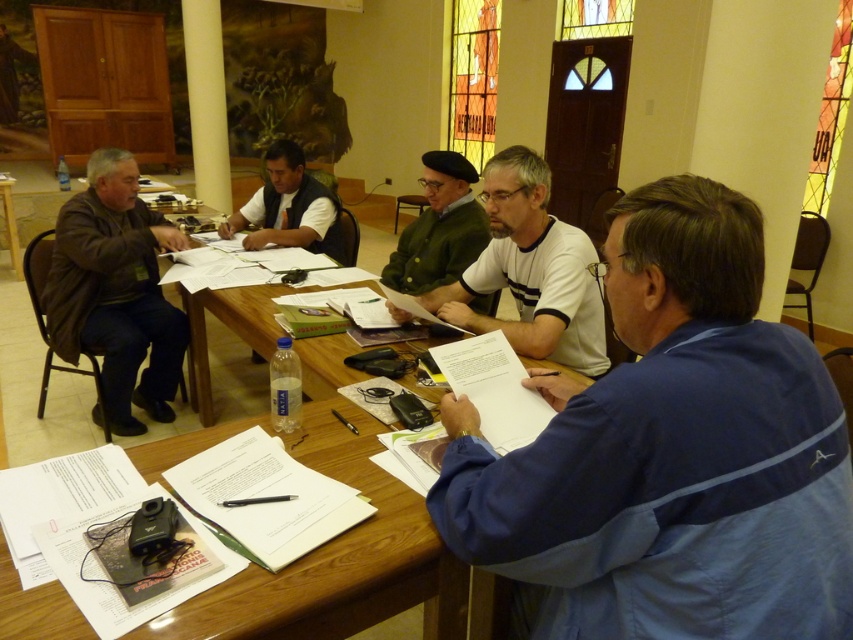
Looking at this image, is white cotton shirt at center wider than wooden table at center?

Yes.

In the scene shown: Is white cotton shirt at center above wooden table at center?

Actually, white cotton shirt at center is below wooden table at center.

Between point (519, 156) and point (12, 211), which one is positioned in front?

Point (519, 156) is in front.

Identify the location of white cotton shirt at center. point(531,269).

Who is lower down, blue fabric shirt at center or white cotton shirt at center?

blue fabric shirt at center is below.

Where is `blue fabric shirt at center`? Image resolution: width=853 pixels, height=640 pixels. blue fabric shirt at center is located at coordinates (670, 452).

Where is `blue fabric shirt at center`? The width and height of the screenshot is (853, 640). blue fabric shirt at center is located at coordinates (670, 452).

At what (x,y) coordinates should I click in order to perform the action: click on blue fabric shirt at center. Please return your answer as a coordinate pair (x, y). The image size is (853, 640). Looking at the image, I should click on (670, 452).

Consider the image. Who is taller, blue fabric shirt at center or green matte jacket at center?

With more height is blue fabric shirt at center.

Does blue fabric shirt at center have a lesser height compared to green matte jacket at center?

In fact, blue fabric shirt at center may be taller than green matte jacket at center.

Locate an element on the screen. blue fabric shirt at center is located at coordinates (670, 452).